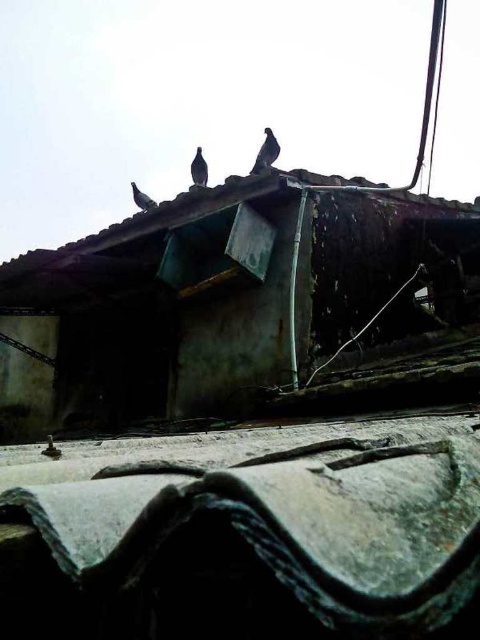
Question: Which object appears farthest from the camera in this image?

Choices:
 (A) dark gray feathered bird at upper center
 (B) gray textured tile roof at lower center

Answer: (A)

Question: Which of the following is the farthest from the observer?

Choices:
 (A) dark gray feathered bird at upper center
 (B) gray matte pigeon at upper center
 (C) rusty metal hut at upper center

Answer: (A)

Question: Does gray textured tile roof at lower center appear under dark gray feathered bird at upper center?

Choices:
 (A) no
 (B) yes

Answer: (B)

Question: Among these objects, which one is farthest from the camera?

Choices:
 (A) gray matte pigeon at upper center
 (B) dark gray feathered bird at upper center

Answer: (B)

Question: Is gray matte pigeon at upper center closer to the viewer compared to dark gray feathered bird at upper center?

Choices:
 (A) yes
 (B) no

Answer: (A)

Question: Does rusty metal hut at upper center have a larger size compared to dark gray feathered bird at upper center?

Choices:
 (A) no
 (B) yes

Answer: (A)